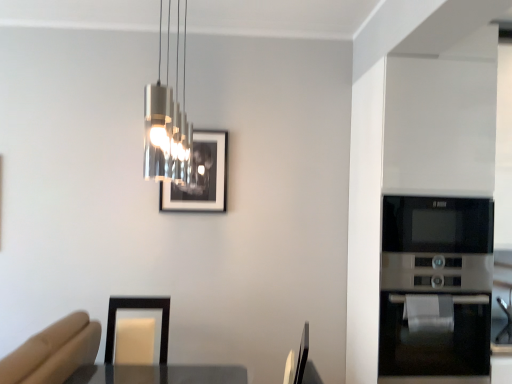
Question: Are matte black picture frame at upper center and black glass microwave at right making contact?

Choices:
 (A) yes
 (B) no

Answer: (B)

Question: Does matte black picture frame at upper center have a lesser height compared to black glass microwave at right?

Choices:
 (A) no
 (B) yes

Answer: (B)

Question: Are matte black picture frame at upper center and black glass microwave at right located far from each other?

Choices:
 (A) yes
 (B) no

Answer: (A)

Question: From a real-world perspective, is matte black picture frame at upper center located beneath black glass microwave at right?

Choices:
 (A) yes
 (B) no

Answer: (B)

Question: Can you confirm if matte black picture frame at upper center is smaller than black glass microwave at right?

Choices:
 (A) no
 (B) yes

Answer: (B)

Question: Is matte black picture frame at upper center bigger or smaller than black glass microwave at right?

Choices:
 (A) big
 (B) small

Answer: (B)

Question: In the image, is matte black picture frame at upper center on the left side or the right side of black glass microwave at right?

Choices:
 (A) left
 (B) right

Answer: (A)

Question: In terms of width, does matte black picture frame at upper center look wider or thinner when compared to black glass microwave at right?

Choices:
 (A) thin
 (B) wide

Answer: (A)

Question: Is point click(169, 201) closer or farther from the camera than point click(406, 354)?

Choices:
 (A) closer
 (B) farther

Answer: (B)

Question: From a real-world perspective, is metallic cylindrical light fixture at upper center physically located above or below matte black picture frame at upper center?

Choices:
 (A) above
 (B) below

Answer: (A)

Question: Relative to matte black picture frame at upper center, is metallic cylindrical light fixture at upper center in front or behind?

Choices:
 (A) behind
 (B) front

Answer: (B)

Question: Would you say metallic cylindrical light fixture at upper center is to the left or to the right of matte black picture frame at upper center in the picture?

Choices:
 (A) right
 (B) left

Answer: (A)

Question: Is metallic cylindrical light fixture at upper center taller or shorter than matte black picture frame at upper center?

Choices:
 (A) short
 (B) tall

Answer: (B)

Question: From a real-world perspective, is metallic cylindrical light fixture at upper center physically located above or below black glass microwave at right?

Choices:
 (A) below
 (B) above

Answer: (B)

Question: In the image, is metallic cylindrical light fixture at upper center on the left side or the right side of black glass microwave at right?

Choices:
 (A) right
 (B) left

Answer: (B)